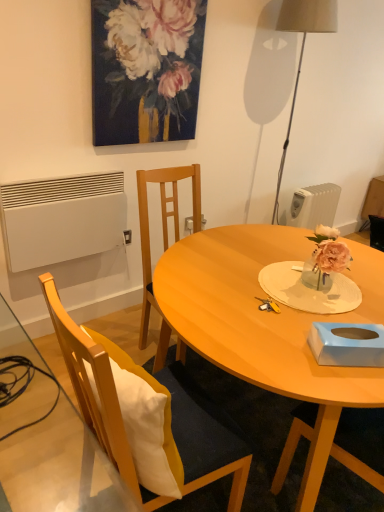
Where is `free space above matte wood table at center (from a real-world perspective)`? free space above matte wood table at center (from a real-world perspective) is located at coordinates (280, 291).